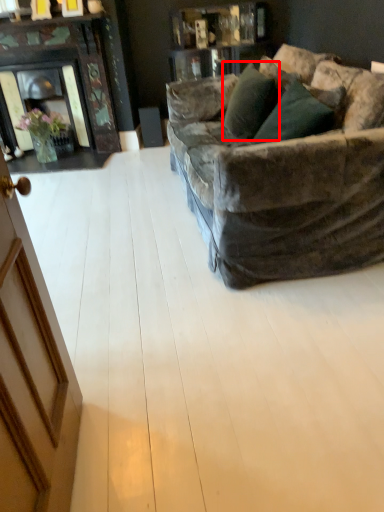
Question: From the image, what is the correct spatial relationship of pillow (annotated by the red box) in relation to plywood?

Choices:
 (A) left
 (B) right

Answer: (B)